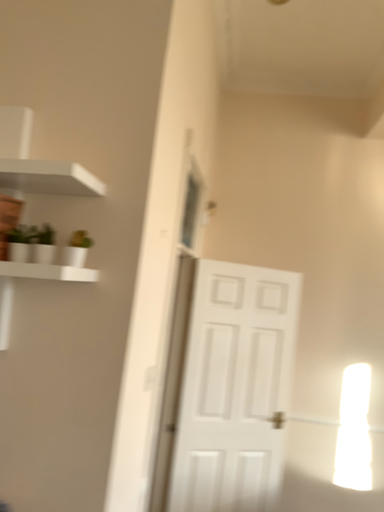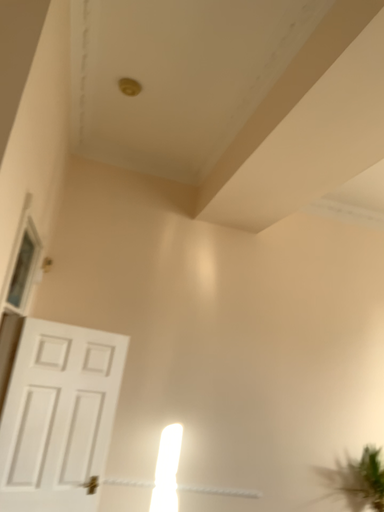
Question: How did the camera likely rotate when shooting the video?

Choices:
 (A) rotated left
 (B) rotated right

Answer: (B)